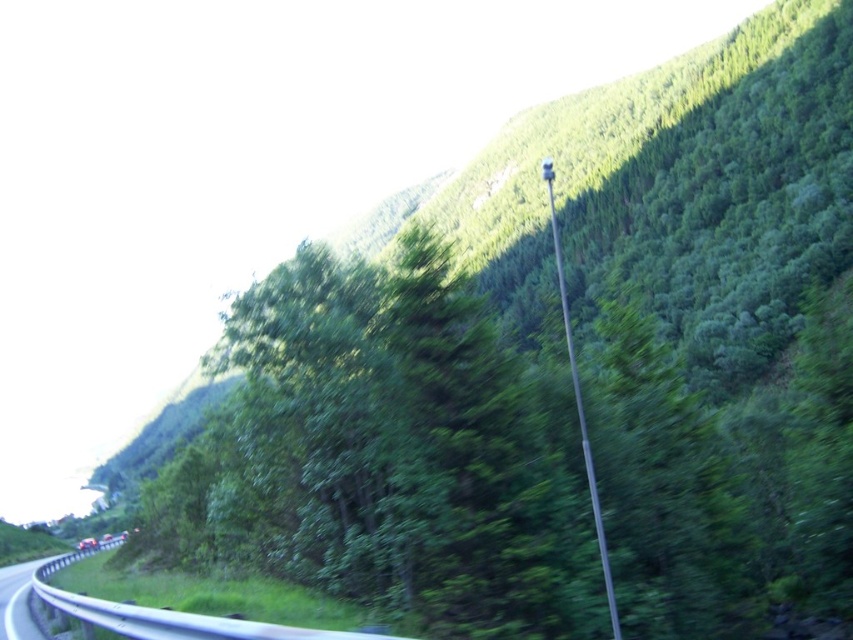
Does point (550, 161) come behind point (22, 593)?

Yes, point (550, 161) is behind point (22, 593).

Which is behind, point (579, 403) or point (9, 625)?

Positioned behind is point (9, 625).

In order to click on silver metallic pole at center-right in this screenshot , I will do `click(579, 406)`.

At what (x,y) coordinates should I click in order to perform the action: click on silver metallic pole at center-right. Please return your answer as a coordinate pair (x, y). Looking at the image, I should click on (579, 406).

Does green leafy hillside at upper center have a lesser height compared to metallic gray highway at lower left?

No, green leafy hillside at upper center is not shorter than metallic gray highway at lower left.

Looking at this image, can you confirm if green leafy hillside at upper center is positioned to the right of metallic gray highway at lower left?

Correct, you'll find green leafy hillside at upper center to the right of metallic gray highway at lower left.

Does point (730, 188) come closer to viewer compared to point (32, 573)?

No.

Where is `green leafy hillside at upper center`? green leafy hillside at upper center is located at coordinates (677, 192).

Identify the location of green leafy hillside at upper center. This screenshot has height=640, width=853. (677, 192).

Which is below, green leafy hillside at upper center or silver metallic pole at center-right?

silver metallic pole at center-right is below.

The image size is (853, 640). Find the location of `green leafy hillside at upper center`. green leafy hillside at upper center is located at coordinates (677, 192).

This screenshot has height=640, width=853. Find the location of `green leafy hillside at upper center`. green leafy hillside at upper center is located at coordinates (677, 192).